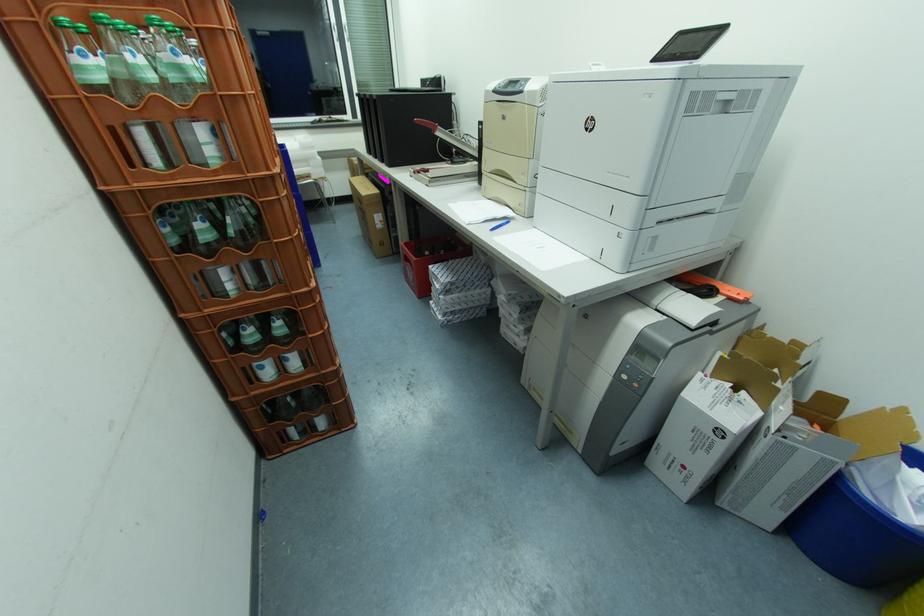
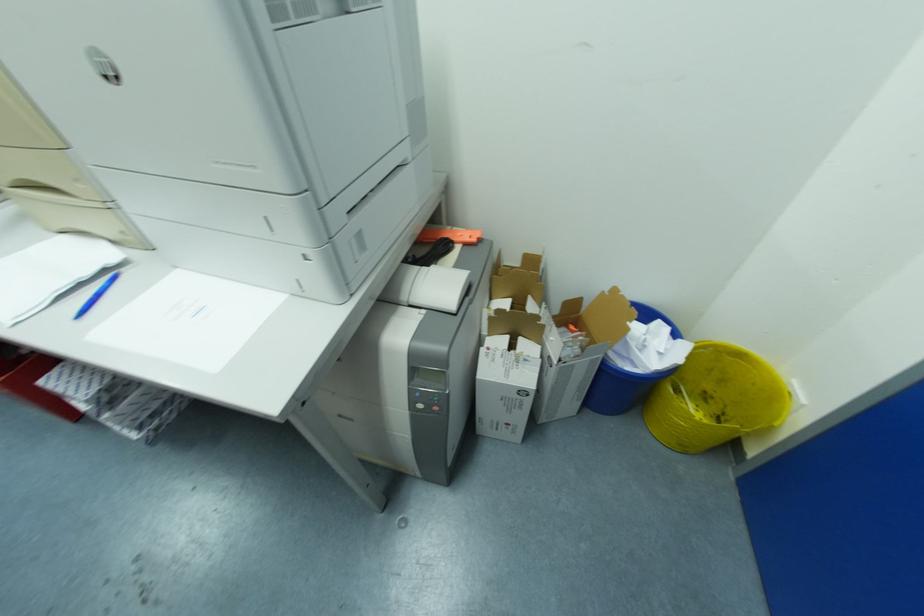
Based on the continuous images, in which direction is the camera rotating?

The rotation direction of the camera is right-down.